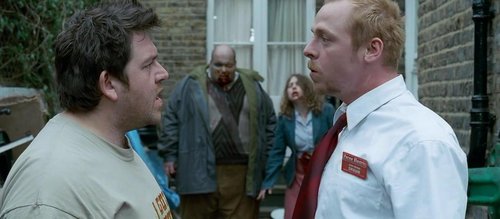
Find the location of a particular element. This screenshot has width=500, height=219. brick walls is located at coordinates (188, 36), (451, 67).